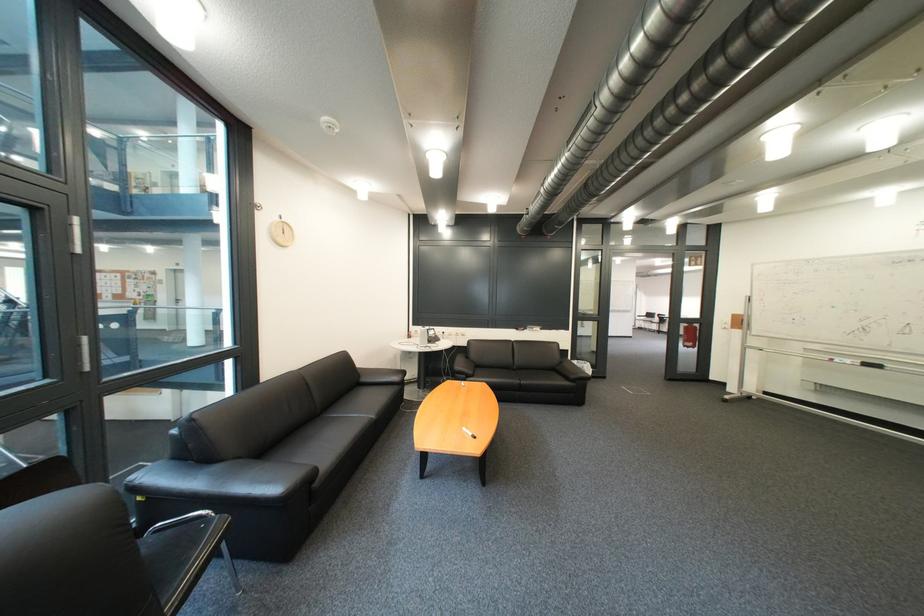
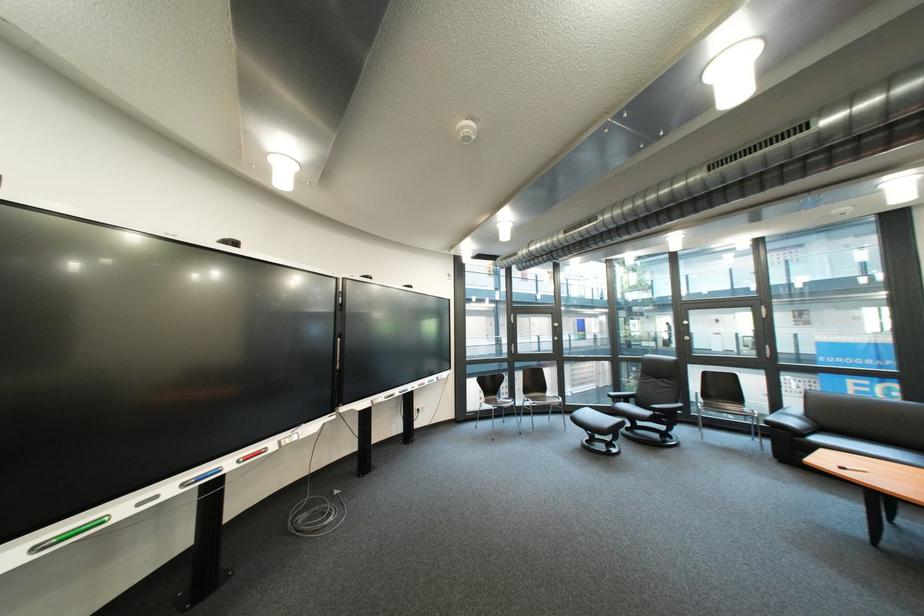
The point at (483, 436) is marked in the first image. Where is the corresponding point in the second image?

(862, 469)